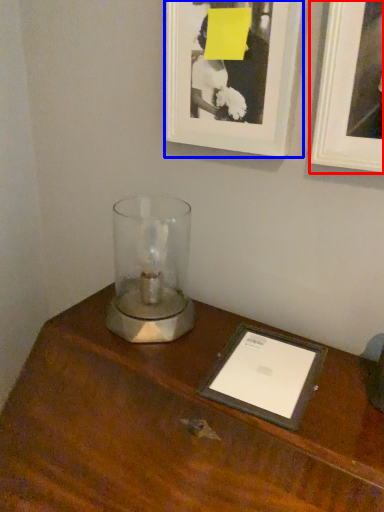
Question: Among these objects, which one is nearest to the camera, picture frame (highlighted by a red box) or picture frame (highlighted by a blue box)?

Choices:
 (A) picture frame
 (B) picture frame

Answer: (A)